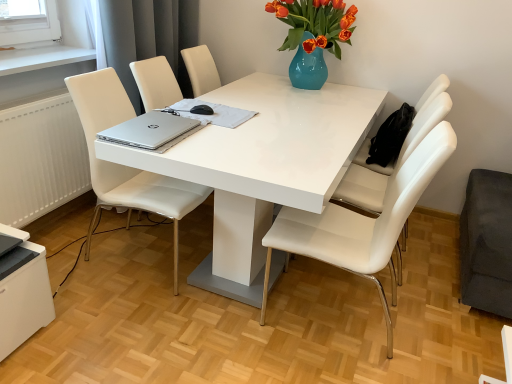
The height and width of the screenshot is (384, 512). What are the coordinates of `vacant position to the left of white leather chair at center, the third chair viewed from the right` in the screenshot? It's located at (71, 255).